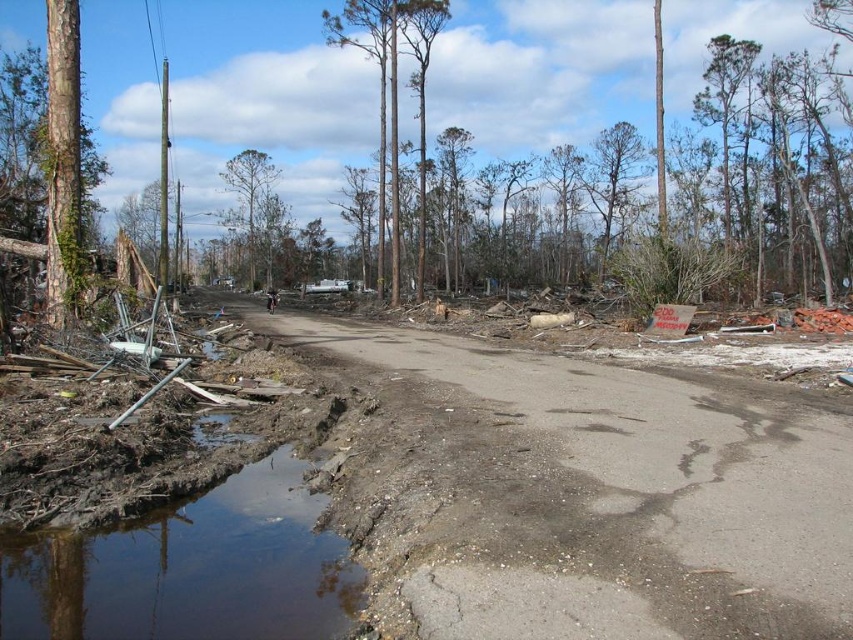
Question: Estimate the real-world distances between objects in this image. Which object is farther from the brown rough textured trees at center?

Choices:
 (A) brown rough tree at center
 (B) brown bark tree at center

Answer: (A)

Question: Considering the relative positions of brown bark tree at center and brown rough tree at center in the image provided, where is brown bark tree at center located with respect to brown rough tree at center?

Choices:
 (A) below
 (B) above

Answer: (A)

Question: Which point is closer to the camera?

Choices:
 (A) brown rough tree at center
 (B) muddy water at lower left
 (C) brown rough textured trees at center

Answer: (B)

Question: Is brown rough textured trees at center closer to camera compared to brown rough tree at center?

Choices:
 (A) yes
 (B) no

Answer: (A)

Question: Does muddy water at lower left appear on the right side of brown rough textured trees at center?

Choices:
 (A) no
 (B) yes

Answer: (B)

Question: Estimate the real-world distances between objects in this image. Which object is farther from the brown bark tree at center?

Choices:
 (A) brown rough tree at center
 (B) brown rough textured trees at center
 (C) muddy water at lower left

Answer: (C)